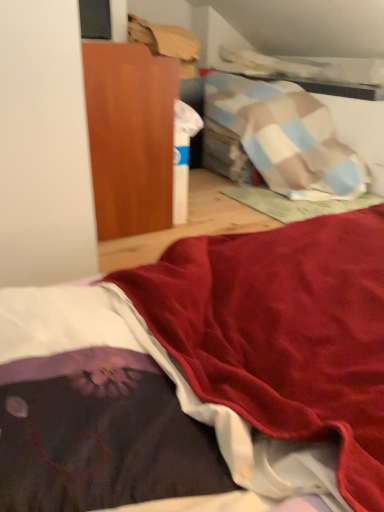
Image resolution: width=384 pixels, height=512 pixels. What do you see at coordinates (130, 136) in the screenshot?
I see `wooden cabinet at upper left` at bounding box center [130, 136].

Where is `wooden cabinet at upper left`? The width and height of the screenshot is (384, 512). wooden cabinet at upper left is located at coordinates click(130, 136).

What do you see at coordinates (203, 375) in the screenshot? I see `velvet dark purple blanket at lower left` at bounding box center [203, 375].

Where is `velvet dark purple blanket at lower left`? velvet dark purple blanket at lower left is located at coordinates (203, 375).

You are a GUI agent. You are given a task and a screenshot of the screen. Output one action in this format:
    pyautogui.click(x=<x>, y=<y>)
    Task: Click on the wooden cabinet at upper left
    This screenshot has width=384, height=512.
    Given the screenshot: What is the action you would take?
    pyautogui.click(x=130, y=136)

Which object is positioned more to the right, velvet dark purple blanket at lower left or wooden cabinet at upper left?

velvet dark purple blanket at lower left.

Looking at this image, which is behind, velvet dark purple blanket at lower left or wooden cabinet at upper left?

wooden cabinet at upper left is more distant.

Is point (61, 340) behind point (108, 103)?

No, it is not.

From the image's perspective, which one is positioned higher, velvet dark purple blanket at lower left or wooden cabinet at upper left?

wooden cabinet at upper left appears higher in the image.

From a real-world perspective, relative to wooden cabinet at upper left, is velvet dark purple blanket at lower left vertically above or below?

velvet dark purple blanket at lower left is below wooden cabinet at upper left.

Is velvet dark purple blanket at lower left wider or thinner than wooden cabinet at upper left?

velvet dark purple blanket at lower left is thinner than wooden cabinet at upper left.

From their relative heights in the image, would you say velvet dark purple blanket at lower left is taller or shorter than wooden cabinet at upper left?

velvet dark purple blanket at lower left is shorter than wooden cabinet at upper left.

Who is bigger, velvet dark purple blanket at lower left or wooden cabinet at upper left?

Bigger between the two is wooden cabinet at upper left.

Is wooden cabinet at upper left inside velvet dark purple blanket at lower left?

No, velvet dark purple blanket at lower left does not contain wooden cabinet at upper left.

Would you consider velvet dark purple blanket at lower left to be distant from wooden cabinet at upper left?

Actually, velvet dark purple blanket at lower left and wooden cabinet at upper left are a little close together.

Is velvet dark purple blanket at lower left turned away from wooden cabinet at upper left?

No, wooden cabinet at upper left is not at the back of velvet dark purple blanket at lower left.

Locate an element on the screen. The image size is (384, 512). bed in front of the wooden cabinet at upper left is located at coordinates (203, 375).

Considering the relative positions of wooden cabinet at upper left and velvet dark purple blanket at lower left in the image provided, is wooden cabinet at upper left to the left of velvet dark purple blanket at lower left from the viewer's perspective?

Yes.

Relative to velvet dark purple blanket at lower left, is wooden cabinet at upper left in front or behind?

wooden cabinet at upper left is positioned farther from the viewer than velvet dark purple blanket at lower left.

Is point (96, 134) closer to camera compared to point (17, 507)?

No, it is behind (17, 507).

From the image's perspective, would you say wooden cabinet at upper left is positioned over velvet dark purple blanket at lower left?

Correct, wooden cabinet at upper left appears higher than velvet dark purple blanket at lower left in the image.

From a real-world perspective, who is located lower, wooden cabinet at upper left or velvet dark purple blanket at lower left?

From a 3D spatial view, velvet dark purple blanket at lower left is below.

Is wooden cabinet at upper left thinner than velvet dark purple blanket at lower left?

In fact, wooden cabinet at upper left might be wider than velvet dark purple blanket at lower left.

Who is taller, wooden cabinet at upper left or velvet dark purple blanket at lower left?

Standing taller between the two is wooden cabinet at upper left.

Between wooden cabinet at upper left and velvet dark purple blanket at lower left, which one has smaller size?

velvet dark purple blanket at lower left is smaller.

Is wooden cabinet at upper left positioned beyond the bounds of velvet dark purple blanket at lower left?

Yes, wooden cabinet at upper left is located beyond the bounds of velvet dark purple blanket at lower left.

Would you consider wooden cabinet at upper left to be distant from velvet dark purple blanket at lower left?

No, wooden cabinet at upper left is in close proximity to velvet dark purple blanket at lower left.

Could you tell me if wooden cabinet at upper left is turned towards velvet dark purple blanket at lower left?

No, wooden cabinet at upper left does not turn towards velvet dark purple blanket at lower left.

How many degrees apart are the facing directions of wooden cabinet at upper left and velvet dark purple blanket at lower left?

They differ by 171 degrees in their facing directions.

How distant is wooden cabinet at upper left from velvet dark purple blanket at lower left?

wooden cabinet at upper left is 38.11 inches from velvet dark purple blanket at lower left.

Locate an element on the screen. The image size is (384, 512). bed on the right of wooden cabinet at upper left is located at coordinates (203, 375).

In the image, there is a velvet dark purple blanket at lower left. Find the location of `furniture above it (from the image's perspective)`. furniture above it (from the image's perspective) is located at coordinates (130, 136).

At what (x,y) coordinates should I click in order to perform the action: click on furniture on the left side of velvet dark purple blanket at lower left. Please return your answer as a coordinate pair (x, y). Looking at the image, I should click on click(130, 136).